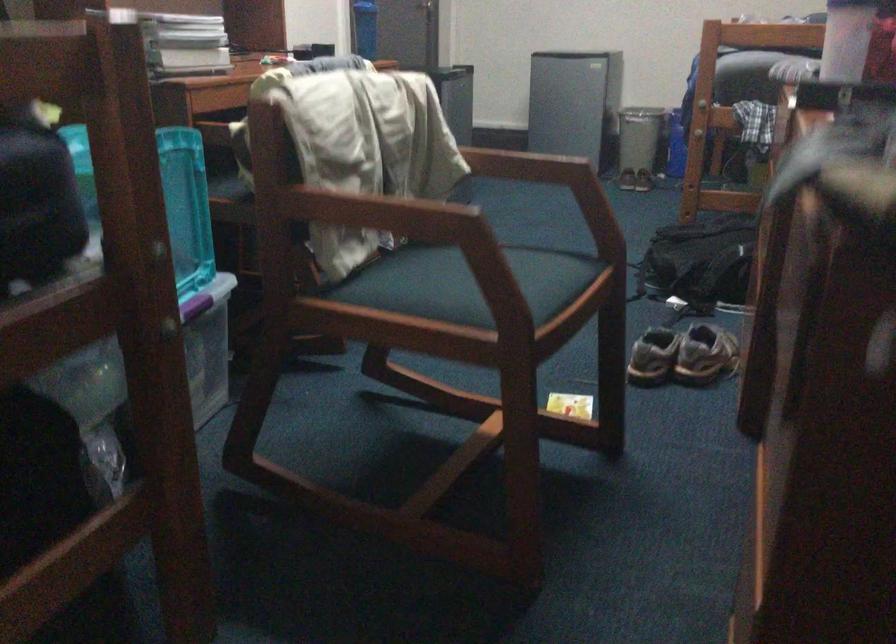
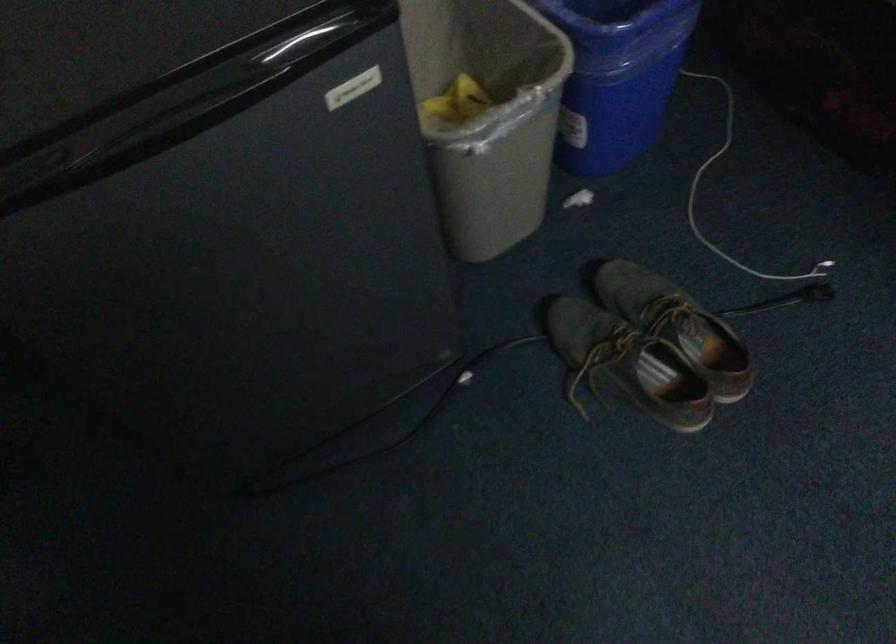
The point at (627, 142) is marked in the first image. Where is the corresponding point in the second image?

(662, 323)